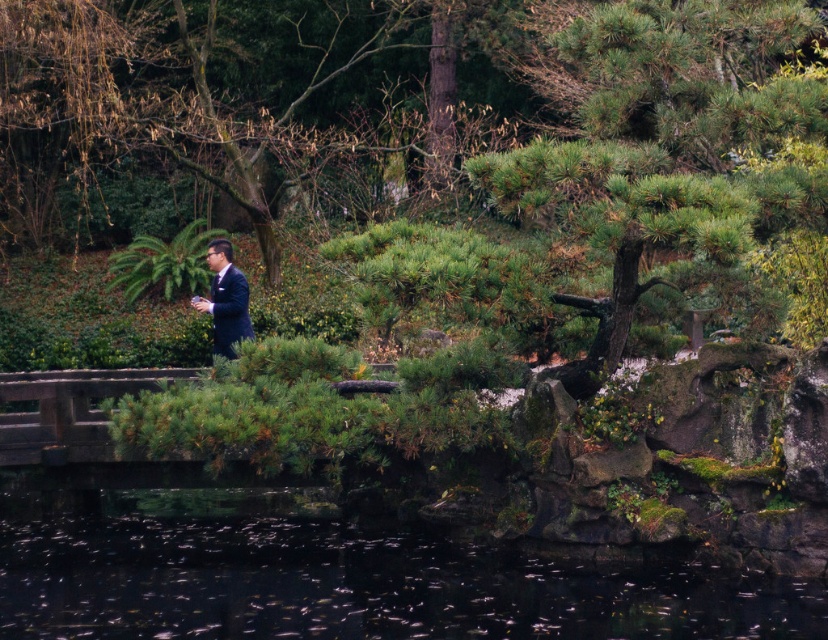
Based on the photo, you are standing at the wooden bridge in the midground of the Japanese garden scene. You notice two points marked in the image. Which point, point [374,589] or point [210,252], is closer to you?

Point [374,589] is closer to the camera than point [210,252].

You are standing on the wooden bridge in the midground of the Japanese garden scene. You see a point marked at coordinates (328, 570). What is located at that point?

The point at coordinates (328, 570) marks transparent water at lower center.

You are standing in the Japanese garden and want to cross the wooden bridge. You see the transparent water at lower center and the matte black suit at center. Which object is closer to you as you approach the bridge?

The transparent water at lower center is closer to the viewer than the matte black suit at center, so the transparent water at lower center would be closer as you approach the bridge.